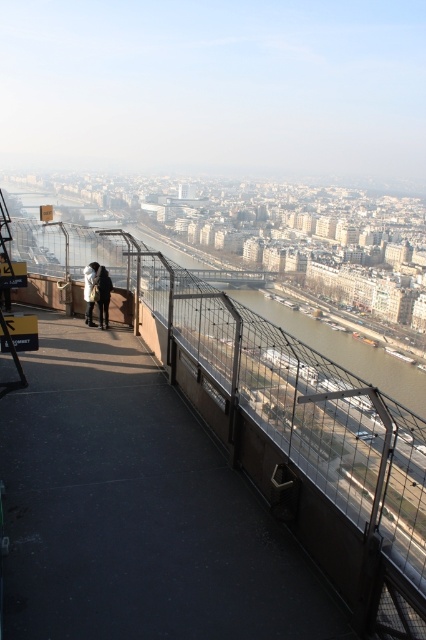
Is black leather jacket at upper left wider than dark gray jacket at center?

No, black leather jacket at upper left is not wider than dark gray jacket at center.

Who is positioned more to the left, black leather jacket at upper left or dark gray jacket at center?

Positioned to the left is dark gray jacket at center.

This screenshot has height=640, width=426. Identify the location of black leather jacket at upper left. (103, 292).

Between black rubber path at center and black leather jacket at upper left, which one has more height?

black rubber path at center

Does black rubber path at center have a greater width compared to black leather jacket at upper left?

Yes, black rubber path at center is wider than black leather jacket at upper left.

Between point (342, 637) and point (106, 296), which one is positioned behind?

Positioned behind is point (106, 296).

Identify the location of black rubber path at center. (137, 509).

Which of these two, black rubber path at center or dark gray jacket at center, stands shorter?

dark gray jacket at center is shorter.

Does black rubber path at center appear under dark gray jacket at center?

Indeed, black rubber path at center is positioned under dark gray jacket at center.

Between point (209, 492) and point (85, 268), which one is positioned behind?

Point (85, 268)

The image size is (426, 640). Identify the location of black rubber path at center. (137, 509).